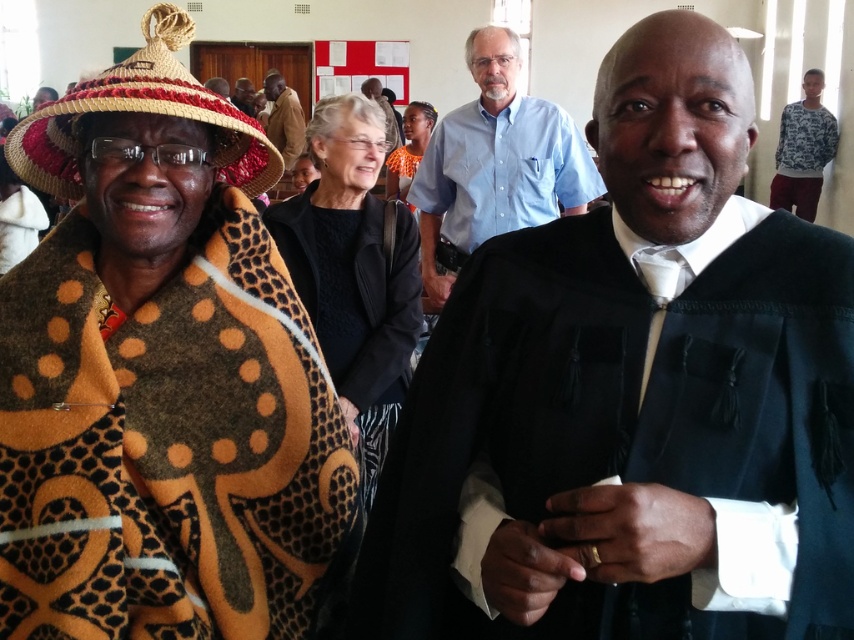
Question: Which object appears closest to the camera in this image?

Choices:
 (A) brown textured blanket at left
 (B) braided straw sombrero at upper left
 (C) orange fabric dress at center
 (D) light blue shirt at center

Answer: (B)

Question: Is white printed sweater at upper right smaller than orange fabric dress at center?

Choices:
 (A) no
 (B) yes

Answer: (B)

Question: Which object appears farthest from the camera in this image?

Choices:
 (A) braided straw sombrero at upper left
 (B) brown textured blanket at left
 (C) light blue button-down shirt at center

Answer: (C)

Question: Can you confirm if velvet black graduation gown at center is positioned to the left of brown leather jacket at center?

Choices:
 (A) yes
 (B) no

Answer: (B)

Question: Which point is farther to the camera?

Choices:
 (A) matte black shirt at center
 (B) light blue button-down shirt at center
 (C) light blue shirt at center
 (D) black woolen sweater at center

Answer: (A)

Question: From the image, what is the correct spatial relationship of orange fabric dress at center in relation to light blue shirt at center?

Choices:
 (A) right
 (B) left

Answer: (A)